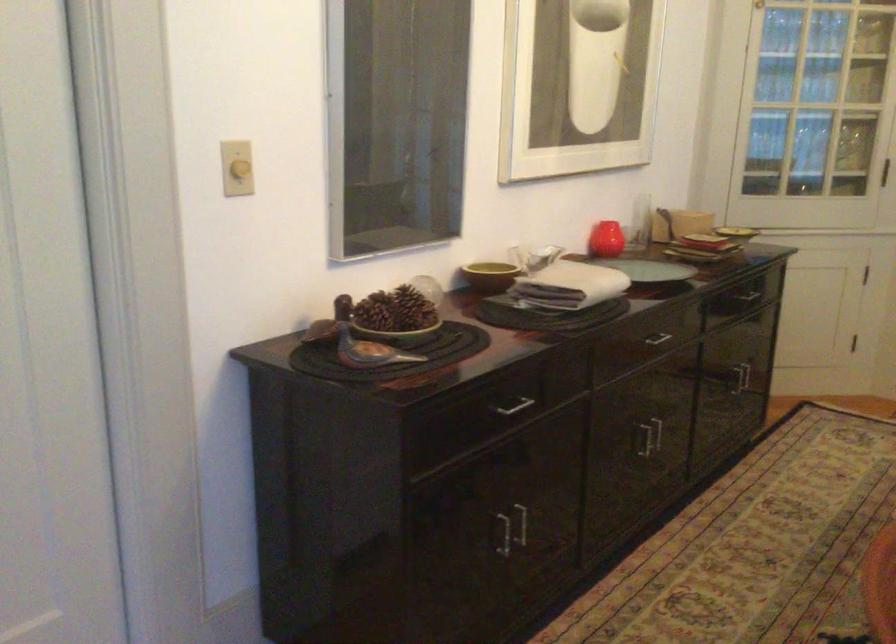
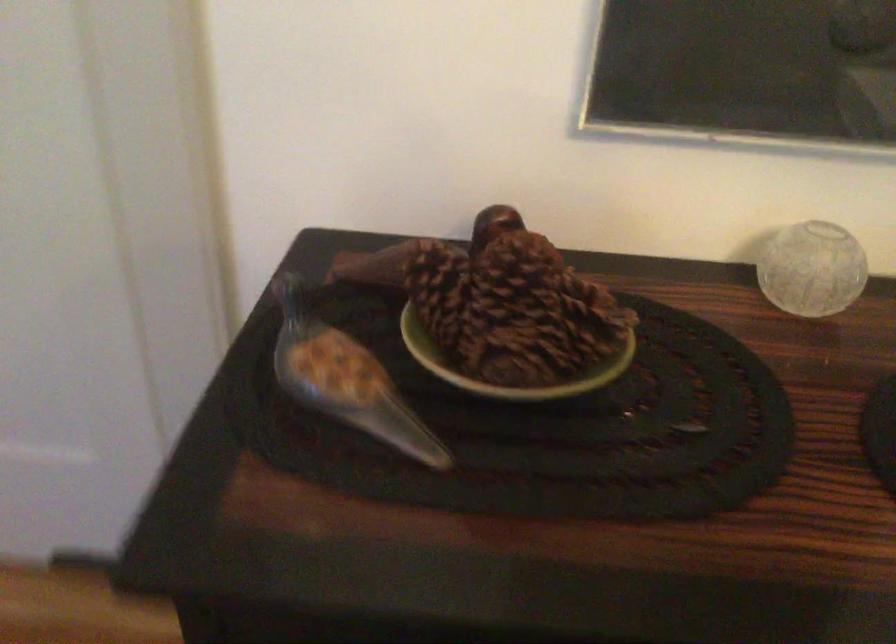
Where in the second image is the point corresponding to point 418,313 from the first image?

(506, 366)